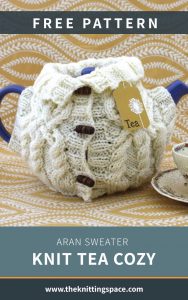
Where is `bowl`? bowl is located at coordinates (184, 151).